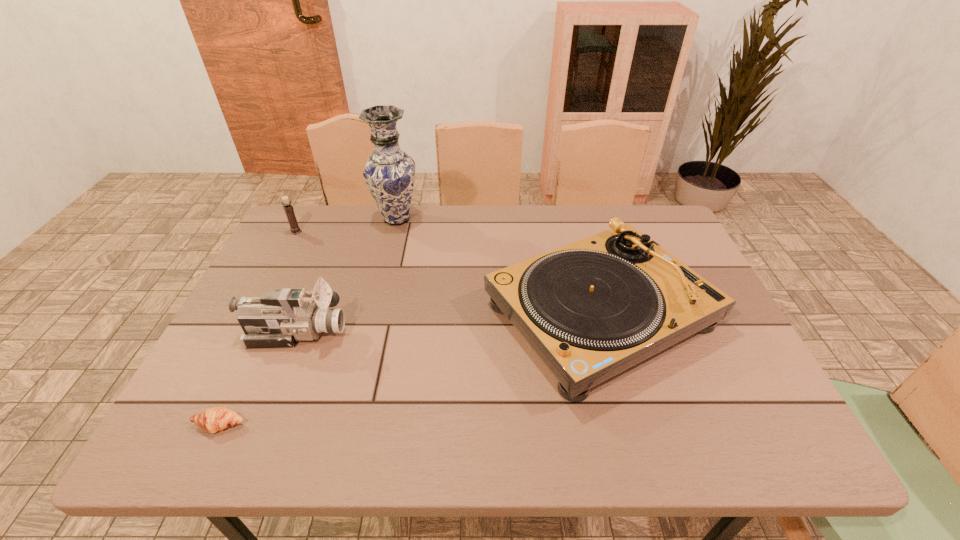
I want to click on vase, so click(x=389, y=172).

Identify the location of camcorder. (279, 318).

You are a GUI agent. You are given a task and a screenshot of the screen. Output one action in this format:
    pyautogui.click(x=<x>, y=<y>)
    Task: Click on the record player
    
    Given the screenshot: What is the action you would take?
    pyautogui.click(x=591, y=309)

Locate an element on the screen. The image size is (960, 540). candle holder is located at coordinates (294, 228).

Locate an element on the screen. The height and width of the screenshot is (540, 960). the nearest object is located at coordinates (215, 419).

The image size is (960, 540). What are the coordinates of `pastry` in the screenshot? It's located at (215, 419).

Locate an element on the screen. vacant area situated on the front of the vase is located at coordinates (380, 289).

In order to click on vacant position located on the front-facing side of the camcorder in this screenshot , I will do `click(379, 332)`.

Locate an element on the screen. The image size is (960, 540). free point located on the front of the rightmost object is located at coordinates (636, 442).

I want to click on free space located 0.100m on the front of the candle holder, so click(x=283, y=256).